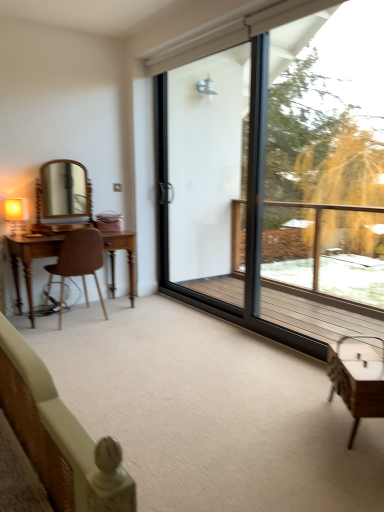
Locate an element on the screen. The image size is (384, 512). vacant space that's between brown leather chair at left and white glossy table at lower right, which is the 1th table from right to left is located at coordinates (203, 360).